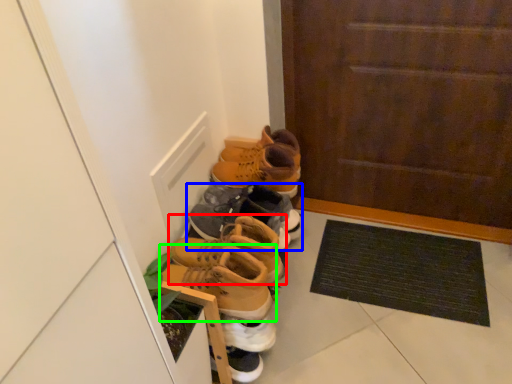
Question: Based on their relative distances, which object is nearer to footwear (highlighted by a red box)? Choose from footwear (highlighted by a blue box) and footwear (highlighted by a green box).

Choices:
 (A) footwear
 (B) footwear

Answer: (B)